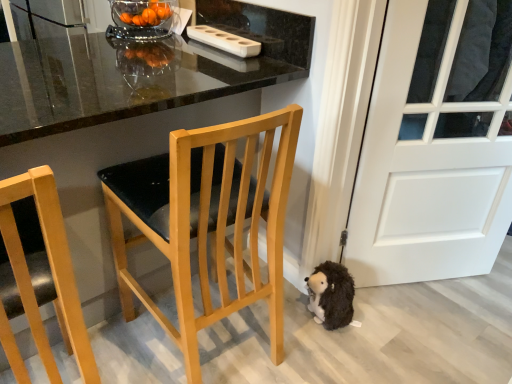
What do you see at coordinates (331, 295) in the screenshot?
I see `fluffy brown plush hedgehog at lower right` at bounding box center [331, 295].

Locate an element on the screen. Image resolution: width=512 pixels, height=384 pixels. light wood chair at center, the first chair in the right-to-left sequence is located at coordinates pos(208,221).

Where is `transparent glass bowl at upper center`? The height and width of the screenshot is (384, 512). transparent glass bowl at upper center is located at coordinates (142, 19).

Locate an element on the screen. white plastic container at upper center is located at coordinates (224, 40).

The image size is (512, 384). Find the location of `chair that is the 2nd object located in front of the white matte door at lower right`. chair that is the 2nd object located in front of the white matte door at lower right is located at coordinates (51, 270).

Which object is positioned more to the right, white matte door at lower right or light wood chair at left, which appears as the 2th chair when viewed from the right?

From the viewer's perspective, white matte door at lower right appears more on the right side.

Is point (408, 156) positioned behind point (21, 247)?

Yes, point (408, 156) is farther from viewer.

From a real-world perspective, is white matte door at lower right located higher than light wood chair at left, which appears as the 2th chair when viewed from the right?

Indeed, from a real-world perspective, white matte door at lower right stands above light wood chair at left, which appears as the 2th chair when viewed from the right.

Between light wood chair at center, the first chair in the right-to-left sequence, and transparent glass bowl at upper center, which one has smaller width?

transparent glass bowl at upper center is thinner.

Find the location of a particular element. Image resolution: width=512 pixels, height=384 pixels. the 1st chair below the transparent glass bowl at upper center (from the image's perspective) is located at coordinates (208, 221).

From a real-world perspective, is light wood chair at center, the first chair in the right-to-left sequence, above or below transparent glass bowl at upper center?

Clearly, from a real-world perspective, light wood chair at center, the first chair in the right-to-left sequence, is below transparent glass bowl at upper center.

Based on the photo, does light wood chair at center, the first chair in the right-to-left sequence, lie behind transparent glass bowl at upper center?

No, light wood chair at center, the first chair in the right-to-left sequence, is closer to the viewer.

Is fluffy brown plush hedgehog at lower right inside light wood chair at center, placed as the second chair when sorted from left to right?

No, fluffy brown plush hedgehog at lower right is located outside of light wood chair at center, placed as the second chair when sorted from left to right.

Does light wood chair at center, placed as the second chair when sorted from left to right, turn towards fluffy brown plush hedgehog at lower right?

No.

Which of these two, light wood chair at center, placed as the second chair when sorted from left to right, or fluffy brown plush hedgehog at lower right, is bigger?

Bigger between the two is light wood chair at center, placed as the second chair when sorted from left to right.

Considering the sizes of objects white matte door at lower right and light wood chair at center, the first chair in the right-to-left sequence, in the image provided, who is smaller, white matte door at lower right or light wood chair at center, the first chair in the right-to-left sequence,?

white matte door at lower right is smaller.

Is point (466, 237) less distant than point (173, 204)?

No, it is not.

Is white matte door at lower right oriented away from light wood chair at center, placed as the second chair when sorted from left to right?

white matte door at lower right does not have its back to light wood chair at center, placed as the second chair when sorted from left to right.

Image resolution: width=512 pixels, height=384 pixels. I want to click on chair lying on the right of glossy black table at center, so click(208, 221).

From the image's perspective, between glossy black table at center and light wood chair at center, placed as the second chair when sorted from left to right, who is located below?

light wood chair at center, placed as the second chair when sorted from left to right.

Is fluffy brown plush hedgehog at lower right taller or shorter than glossy black table at center?

In the image, fluffy brown plush hedgehog at lower right appears to be shorter than glossy black table at center.

Who is smaller, fluffy brown plush hedgehog at lower right or glossy black table at center?

With smaller size is fluffy brown plush hedgehog at lower right.

Is fluffy brown plush hedgehog at lower right in front of or behind glossy black table at center in the image?

In the image, fluffy brown plush hedgehog at lower right appears behind glossy black table at center.

Is fluffy brown plush hedgehog at lower right facing towards glossy black table at center?

Yes, fluffy brown plush hedgehog at lower right is facing glossy black table at center.

How far apart are white plastic container at upper center and white matte door at lower right?

The distance of white plastic container at upper center from white matte door at lower right is 31.25 inches.

Considering the relative sizes of white plastic container at upper center and white matte door at lower right in the image provided, is white plastic container at upper center taller than white matte door at lower right?

No.

Which of these two, white plastic container at upper center or white matte door at lower right, is thinner?

white plastic container at upper center is thinner.

Is point (222, 31) positioned in front of point (375, 141)?

No, it is not.

Image resolution: width=512 pixels, height=384 pixels. In order to click on the 2nd chair in front when counting from the white matte door at lower right in this screenshot , I will do `click(51, 270)`.

Where is `glass bowl above the light wood chair at center, the first chair in the right-to-left sequence (from a real-world perspective)`? glass bowl above the light wood chair at center, the first chair in the right-to-left sequence (from a real-world perspective) is located at coordinates (142, 19).

Looking at the image, which one is located closer to light wood chair at left, which appears as the 2th chair when viewed from the right, white plastic container at upper center or glossy black table at center?

glossy black table at center is closer to light wood chair at left, which appears as the 2th chair when viewed from the right.

In the scene shown: From the image, which object appears to be nearer to light wood chair at left, which appears as the 2th chair when viewed from the right, white plastic container at upper center or white matte door at lower right?

white plastic container at upper center is positioned closer to the anchor light wood chair at left, which appears as the 2th chair when viewed from the right.

Estimate the real-world distances between objects in this image. Which object is further from white plastic container at upper center, fluffy brown plush hedgehog at lower right or white matte door at lower right?

Based on the image, fluffy brown plush hedgehog at lower right appears to be further to white plastic container at upper center.

Based on their spatial positions, is white matte door at lower right or white plastic container at upper center further from transparent glass bowl at upper center?

Among the two, white matte door at lower right is located further to transparent glass bowl at upper center.

Considering their positions, is light wood chair at center, the first chair in the right-to-left sequence, positioned further to transparent glass bowl at upper center than fluffy brown plush hedgehog at lower right?

fluffy brown plush hedgehog at lower right lies further to transparent glass bowl at upper center than the other object.

Based on their spatial positions, is white matte door at lower right or light wood chair at center, the first chair in the right-to-left sequence, further from fluffy brown plush hedgehog at lower right?

The object further to fluffy brown plush hedgehog at lower right is light wood chair at center, the first chair in the right-to-left sequence.

Considering their positions, is white plastic container at upper center positioned further to fluffy brown plush hedgehog at lower right than light wood chair at center, the first chair in the right-to-left sequence?

The object further to fluffy brown plush hedgehog at lower right is white plastic container at upper center.

Considering their positions, is light wood chair at left, marked as the first chair in a left-to-right arrangement, positioned further to glossy black table at center than fluffy brown plush hedgehog at lower right?

fluffy brown plush hedgehog at lower right.

Where is `chair between transparent glass bowl at upper center and white matte door at lower right`? Image resolution: width=512 pixels, height=384 pixels. chair between transparent glass bowl at upper center and white matte door at lower right is located at coordinates (208, 221).

The image size is (512, 384). Identify the location of animal situated between light wood chair at center, the first chair in the right-to-left sequence, and white matte door at lower right from left to right. (331, 295).

Locate an element on the screen. animal between glossy black table at center and white matte door at lower right in the horizontal direction is located at coordinates (331, 295).

Where is `chair between transparent glass bowl at upper center and light wood chair at left, marked as the first chair in a left-to-right arrangement, vertically`? Image resolution: width=512 pixels, height=384 pixels. chair between transparent glass bowl at upper center and light wood chair at left, marked as the first chair in a left-to-right arrangement, vertically is located at coordinates (208, 221).